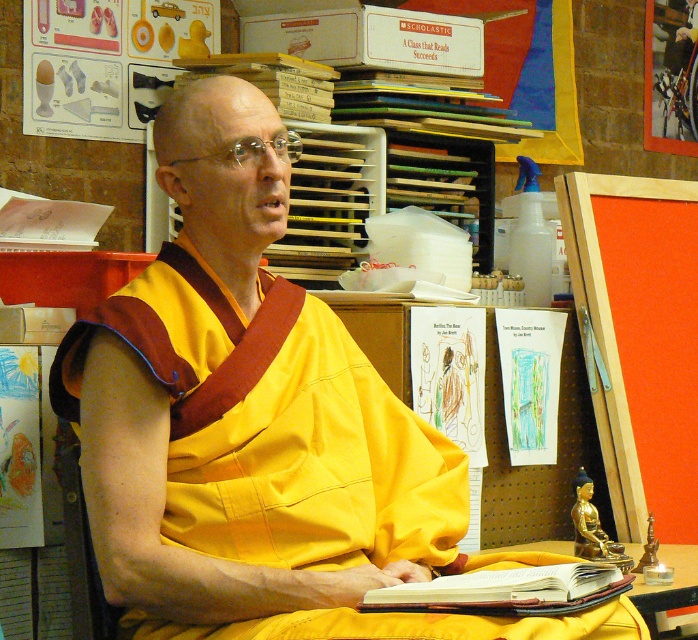
Question: Which of the following is the closest to the observer?

Choices:
 (A) (595, 570)
 (B) (646, 595)

Answer: (A)

Question: Which point is closer to the camera?

Choices:
 (A) leather-bound book at center
 (B) wooden table at lower center

Answer: (A)

Question: Is leather-bound book at center positioned in front of wooden table at lower center?

Choices:
 (A) yes
 (B) no

Answer: (A)

Question: Is the position of leather-bound book at center more distant than that of wooden table at lower center?

Choices:
 (A) yes
 (B) no

Answer: (B)

Question: Is leather-bound book at center thinner than wooden table at lower center?

Choices:
 (A) yes
 (B) no

Answer: (A)